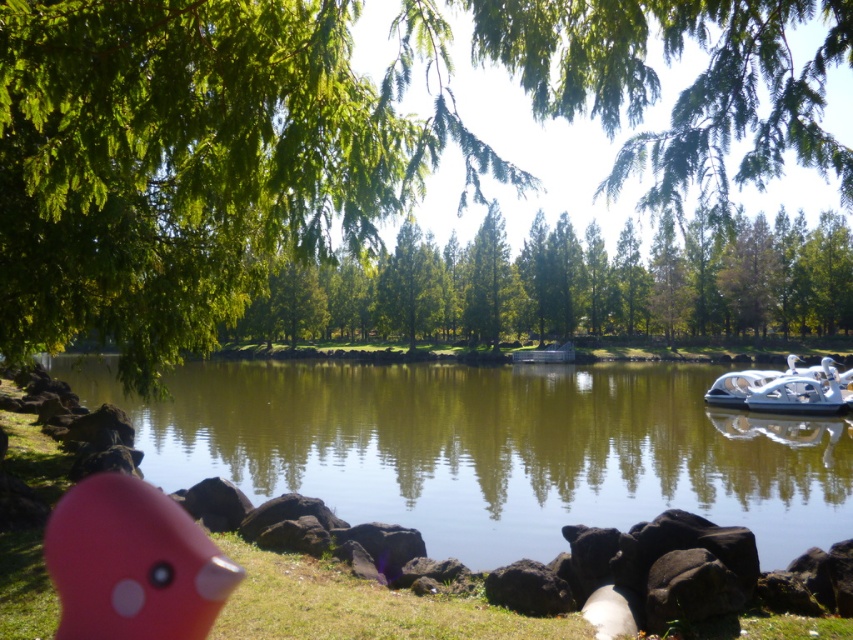
From the picture: You are a photographer setting up a shot of the pink rubber duck at lower left and the white plastic boat at right. Which object should you focus on first if you want to capture both in a single frame without moving the camera?

You should focus on the pink rubber duck at lower left first because it is positioned below the white plastic boat at right, so adjusting focus from the lower to the upper object will ensure both are in frame.

You are a photographer trying to capture the pink rubber duck at lower left and the white plastic boat at right in a single shot. Based on their positions, which object would appear closer to the camera in your photo?

The pink rubber duck at lower left appears closer to the camera because it is positioned in front of the white plastic boat at right.

You are a photographer trying to capture the pink rubber duck at lower left and the green leafy tree at center in the same frame. Which object will appear bigger in your photo?

The green leafy tree at center will appear bigger in the photo because it has a larger size compared to the pink rubber duck at lower left.